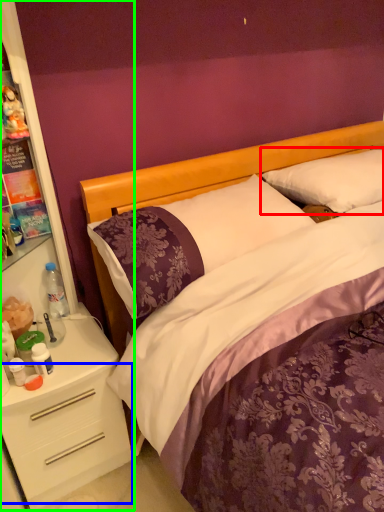
Question: Considering the real-world distances, which object is farthest from pillow (highlighted by a red box)? drawer (highlighted by a blue box) or dresser (highlighted by a green box)?

Choices:
 (A) drawer
 (B) dresser

Answer: (A)